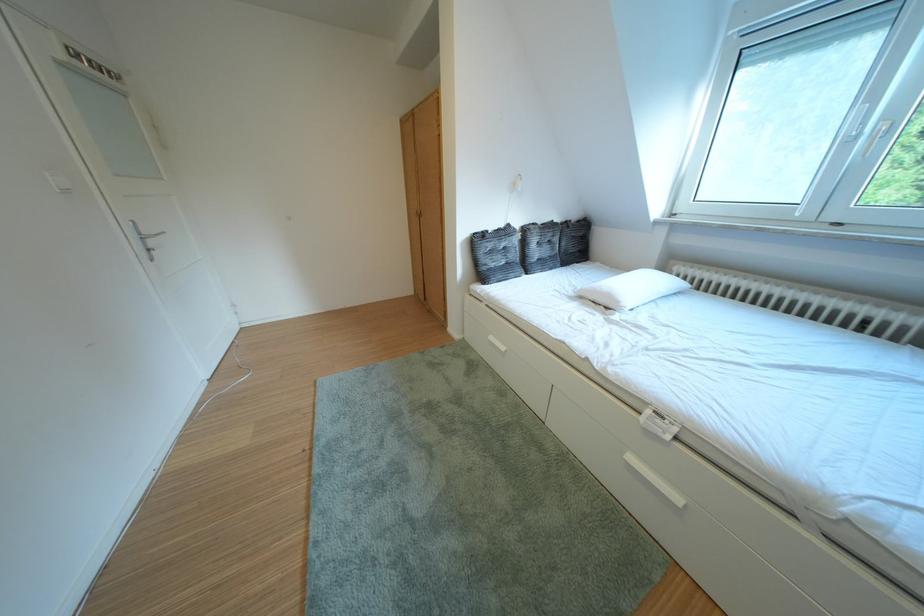
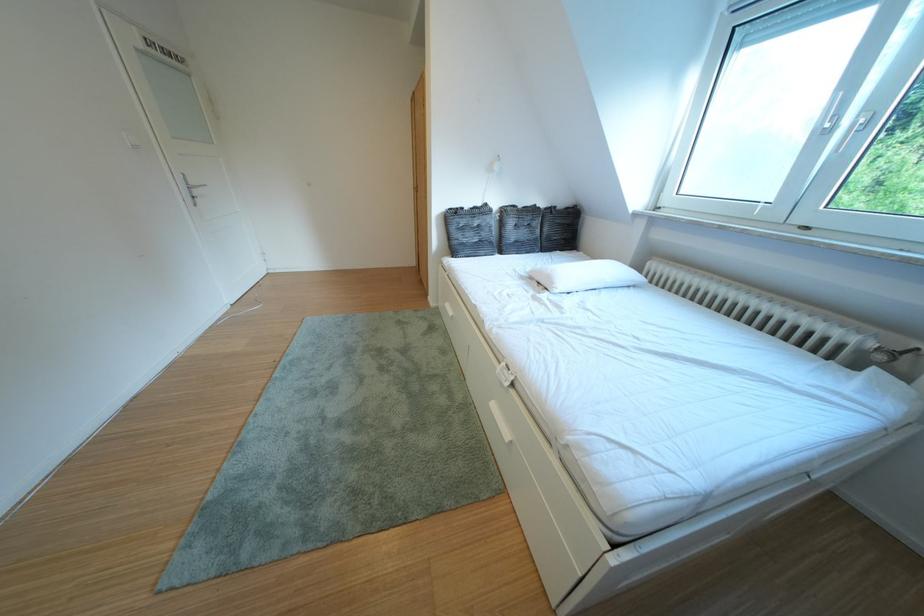
Find the pixel in the second image that matches pixel 505 342 in the first image.

(460, 310)